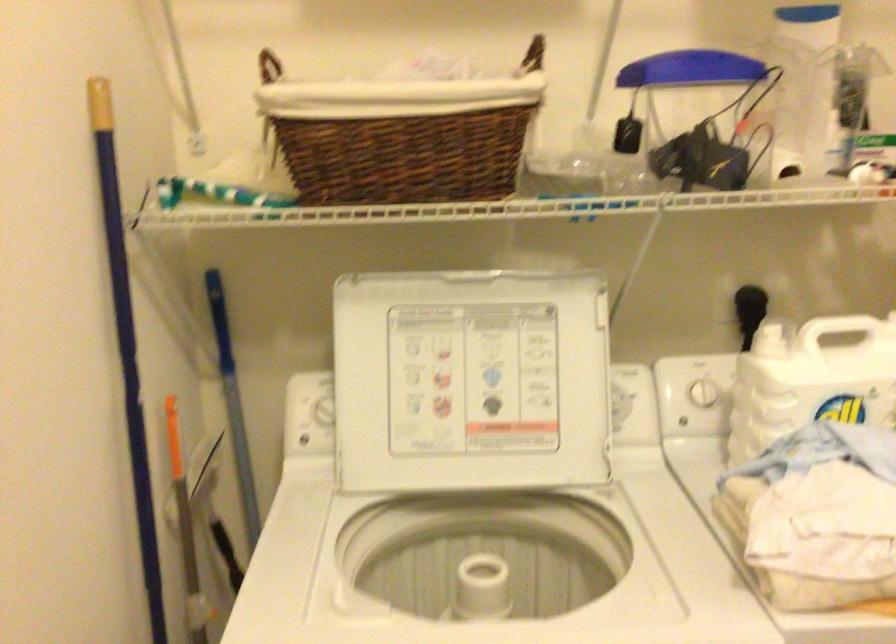
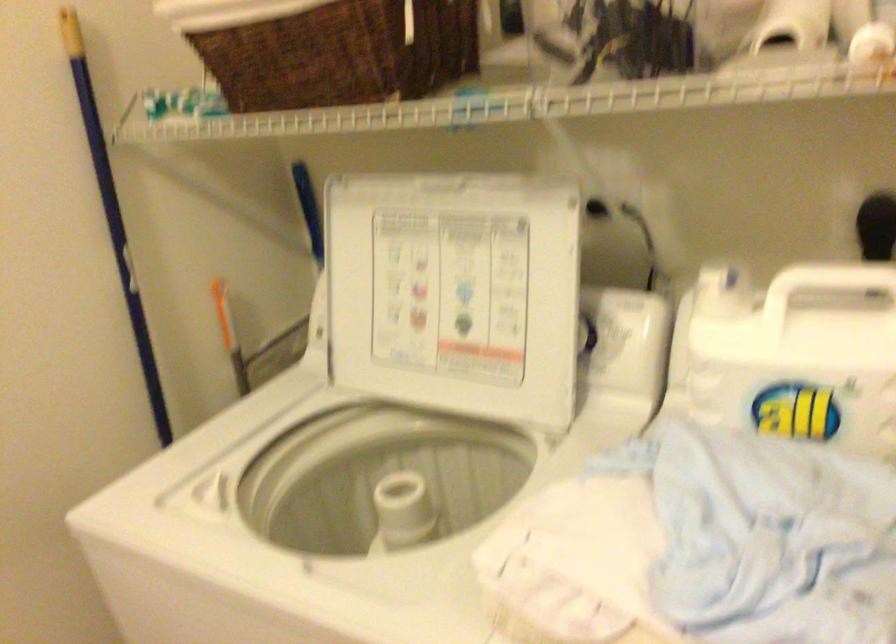
In the second image, find the point that corresponds to (622,391) in the first image.

(616, 325)